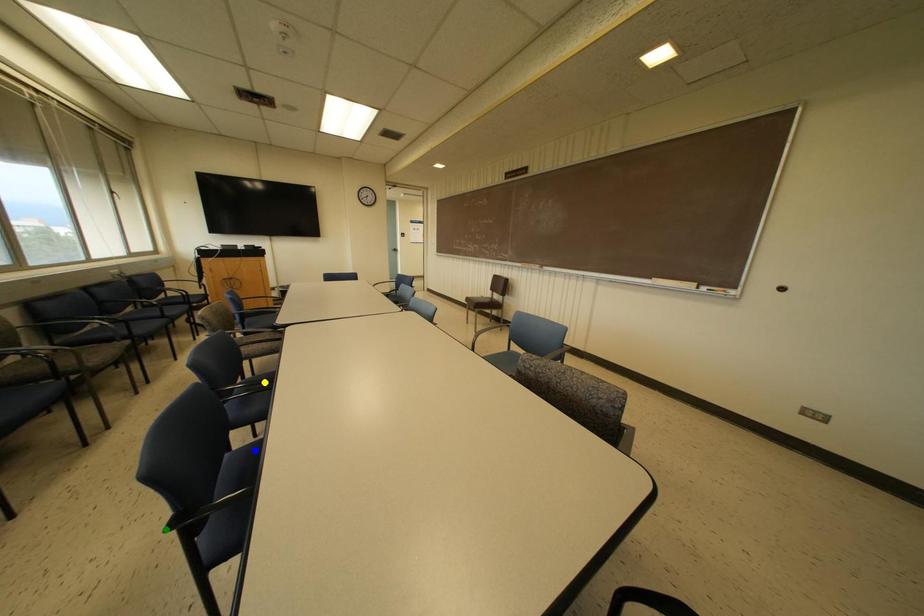
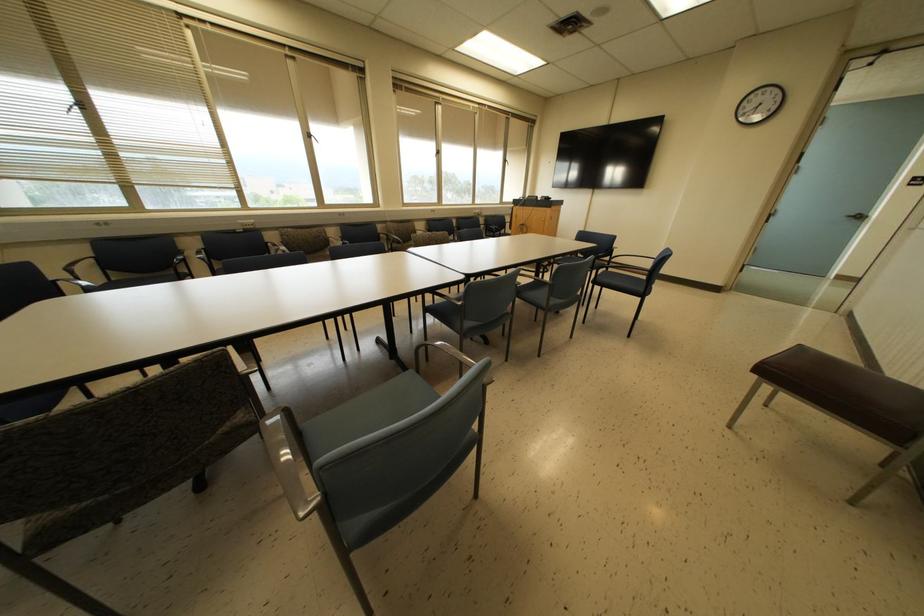
I am providing you with two images of the same scene from different viewpoints. Three points are marked in image1. Which point corresponds to a part or object that is occluded in image2?In image1, three points are marked. Which of them correspond to a part or object that is occluded in image2?Among the three points shown in image1, which one corresponds to a part or object that is no longer visible due to occlusion in image2?

Invisible in image2: blue point, yellow point, green point.